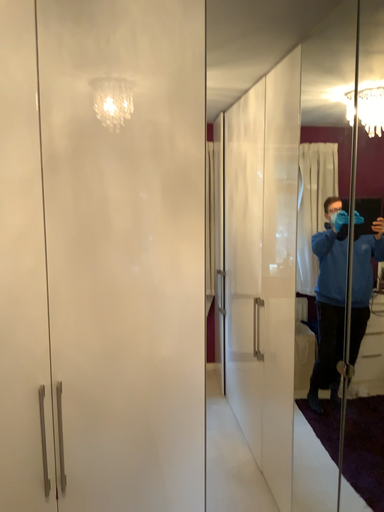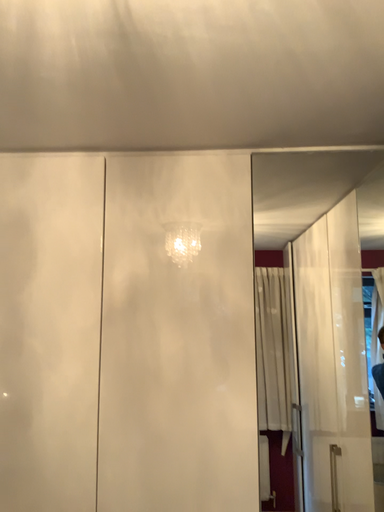
Question: Which way did the camera rotate in the video?

Choices:
 (A) rotated downward
 (B) rotated upward

Answer: (B)